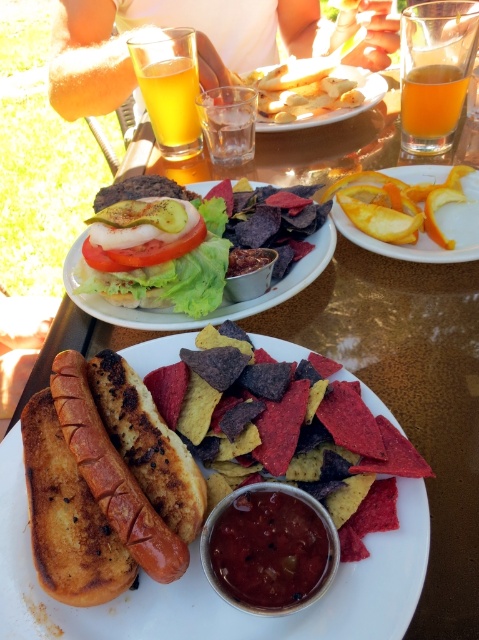
You are a food delivery person who needs to place a hot meal on the table. The grilled bread hot dog at center and golden crispy fries at center are already on the table. Which item is closer to the edge of the table?

The golden crispy fries at center are closer to the edge of the table because the grilled bread hot dog at center is positioned under them, meaning the fries are above and likely closer to the edge.

You are a food critic visiting this outdoor dining spot. You notice two items at the center of the table. Which one is smaller in size between the smokey red paste at center and the golden crispy fries at center?

The smokey red paste at center is smaller in size compared to the golden crispy fries at center.

You are a food critic evaluating the presentation of this meal. Considering the grilled bread hot dog at center and the translucent glass at upper right, which item appears taller when viewed from the front?

The grilled bread hot dog at center appears taller than the translucent glass at upper right because the description states it has a greater height compared to the glass.